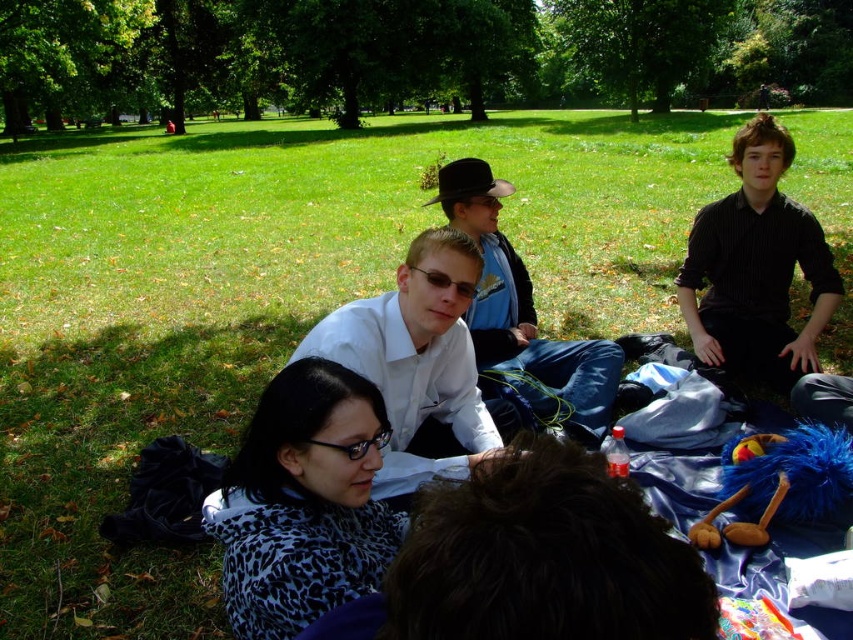
Question: Is leopard print coat at lower left below black striped shirt at center?

Choices:
 (A) no
 (B) yes

Answer: (B)

Question: Estimate the real-world distances between objects in this image. Which object is closer to the black striped shirt at center?

Choices:
 (A) leopard print coat at lower left
 (B) blue fuzzy plush toy at lower right

Answer: (B)

Question: Which object is farther from the camera taking this photo?

Choices:
 (A) black striped shirt at center
 (B) blue fuzzy plush toy at lower right

Answer: (A)

Question: Can you confirm if leopard print coat at lower left is positioned to the right of black striped shirt at center?

Choices:
 (A) no
 (B) yes

Answer: (A)

Question: Which object is the farthest from the black striped shirt at center?

Choices:
 (A) blue fuzzy plush toy at lower right
 (B) leopard print coat at lower left

Answer: (B)

Question: Is black striped shirt at center bigger than blue fuzzy plush toy at lower right?

Choices:
 (A) yes
 (B) no

Answer: (A)